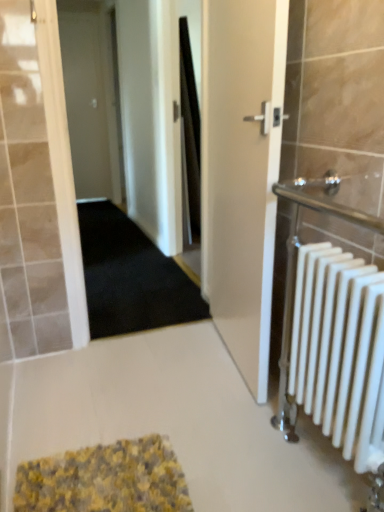
Describe the element at coordinates (85, 103) in the screenshot. I see `white matte door at upper left, the second door when ordered from bottom to top` at that location.

Describe the element at coordinates (340, 350) in the screenshot. I see `white matte radiator at right` at that location.

Where is `white glossy door at center, the first door in the bottom-to-top sequence`? white glossy door at center, the first door in the bottom-to-top sequence is located at coordinates (242, 173).

Where is `white matte door at upper left, the 2th door positioned from the right`? white matte door at upper left, the 2th door positioned from the right is located at coordinates (85, 103).

From the picture: Can you confirm if white glossy door at center, the 2th door from the back, is bigger than black carpet at center?

Actually, white glossy door at center, the 2th door from the back, might be smaller than black carpet at center.

Does white glossy door at center, which is counted as the 1th door, starting from the right, have a lesser width compared to black carpet at center?

Yes.

How many degrees apart are the facing directions of white glossy door at center, which ranks as the 2th door in left-to-right order, and black carpet at center?

The angle between the facing direction of white glossy door at center, which ranks as the 2th door in left-to-right order, and the facing direction of black carpet at center is 94.4 degrees.

Is white glossy door at center, the 2th door from the back, surrounding black carpet at center?

No, black carpet at center is not a part of white glossy door at center, the 2th door from the back.

Is yellow textured bath mat at lower center with black carpet at center?

They are not placed beside each other.

Which object is positioned more to the right, yellow textured bath mat at lower center or black carpet at center?

From the viewer's perspective, yellow textured bath mat at lower center appears more on the right side.

Can we say yellow textured bath mat at lower center lies outside black carpet at center?

Indeed, yellow textured bath mat at lower center is completely outside black carpet at center.

Can you tell me how much white matte door at upper left, the 2th door positioned from the right, and yellow textured bath mat at lower center differ in facing direction?

180 degrees separate the facing orientations of white matte door at upper left, the 2th door positioned from the right, and yellow textured bath mat at lower center.

Considering the sizes of objects white matte door at upper left, the 1th door when ordered from left to right, and yellow textured bath mat at lower center in the image provided, who is bigger, white matte door at upper left, the 1th door when ordered from left to right, or yellow textured bath mat at lower center?

Bigger between the two is white matte door at upper left, the 1th door when ordered from left to right.

Is white matte door at upper left, the 1th door from the back, next to yellow textured bath mat at lower center?

No, white matte door at upper left, the 1th door from the back, is not in contact with yellow textured bath mat at lower center.

Relative to white glossy door at center, the first door in the bottom-to-top sequence, is white matte radiator at right in front or behind?

white matte radiator at right is in front of white glossy door at center, the first door in the bottom-to-top sequence.

Is white matte radiator at right in contact with white glossy door at center, which ranks as the 2th door in left-to-right order?

white matte radiator at right and white glossy door at center, which ranks as the 2th door in left-to-right order, are clearly separated.

Considering the positions of points (325, 295) and (225, 87), is point (325, 295) closer to camera compared to point (225, 87)?

Yes, it is in front of point (225, 87).

Which of these two, white matte radiator at right or white glossy door at center, which ranks as the 2th door in left-to-right order, is smaller?

With smaller size is white matte radiator at right.

From a real-world perspective, does black carpet at center stand above white matte door at upper left, the 1th door when ordered from left to right?

Actually, black carpet at center is physically below white matte door at upper left, the 1th door when ordered from left to right, in the real world.

Considering the sizes of black carpet at center and white matte door at upper left, the 1th door from the back, in the image, is black carpet at center bigger or smaller than white matte door at upper left, the 1th door from the back,?

In the image, black carpet at center appears to be larger than white matte door at upper left, the 1th door from the back.

From the image's perspective, is black carpet at center located above white matte door at upper left, the second door when ordered from bottom to top?

No, from the image's perspective, black carpet at center is not over white matte door at upper left, the second door when ordered from bottom to top.

How much distance is there between black carpet at center and white matte door at upper left, the second door when ordered from bottom to top?

black carpet at center and white matte door at upper left, the second door when ordered from bottom to top, are 2.45 meters apart from each other.

From the image's perspective, between white matte door at upper left, arranged as the 1th door when viewed from the top, and black carpet at center, who is located below?

black carpet at center.

Based on the photo, is black carpet at center at the back of white matte door at upper left, the 1th door from the back?

No, white matte door at upper left, the 1th door from the back,'s orientation is not away from black carpet at center.

Is white matte door at upper left, the 1th door when ordered from left to right, at the left side of black carpet at center?

Indeed, white matte door at upper left, the 1th door when ordered from left to right, is positioned on the left side of black carpet at center.

Measure the distance from white matte door at upper left, the second door when ordered from bottom to top, to black carpet at center.

white matte door at upper left, the second door when ordered from bottom to top, and black carpet at center are 8.04 feet apart from each other.

In order to click on door to the left of white glossy door at center, which ranks as the 2th door in left-to-right order in this screenshot , I will do `click(85, 103)`.

Is white glossy door at center, which is counted as the 1th door, starting from the right, positioned with its back to white matte door at upper left, the 1th door when ordered from left to right?

white glossy door at center, which is counted as the 1th door, starting from the right, is not turned away from white matte door at upper left, the 1th door when ordered from left to right.

Does point (266, 187) lie in front of point (92, 90)?

That is True.

How many degrees apart are the facing directions of white glossy door at center, arranged as the first door when viewed from the front, and white matte door at upper left, the 1th door when ordered from left to right?

white glossy door at center, arranged as the first door when viewed from the front, and white matte door at upper left, the 1th door when ordered from left to right, are facing 94.4 degrees away from each other.

Identify the location of door in front of the black carpet at center. coord(242,173).

There is a yellow textured bath mat at lower center. Where is `doormat above it (from a real-world perspective)`? The image size is (384, 512). doormat above it (from a real-world perspective) is located at coordinates (131, 276).

Estimate the real-world distances between objects in this image. Which object is further from white matte radiator at right, black carpet at center or white matte door at upper left, arranged as the 1th door when viewed from the top?

Among the two, white matte door at upper left, arranged as the 1th door when viewed from the top, is located further to white matte radiator at right.

From the image, which object appears to be nearer to white matte door at upper left, arranged as the 1th door when viewed from the top, black carpet at center or white matte radiator at right?

Based on the image, black carpet at center appears to be nearer to white matte door at upper left, arranged as the 1th door when viewed from the top.

When comparing their distances from white matte radiator at right, does white matte door at upper left, the 1th door from the back, or yellow textured bath mat at lower center seem closer?

yellow textured bath mat at lower center.

Considering their positions, is white matte door at upper left, arranged as the 1th door when viewed from the top, positioned further to white matte radiator at right than black carpet at center?

The object further to white matte radiator at right is white matte door at upper left, arranged as the 1th door when viewed from the top.

Estimate the real-world distances between objects in this image. Which object is closer to white glossy door at center, which ranks as the 2th door in left-to-right order, yellow textured bath mat at lower center or white matte door at upper left, the 1th door when ordered from left to right?

The object closer to white glossy door at center, which ranks as the 2th door in left-to-right order, is yellow textured bath mat at lower center.

When comparing their distances from black carpet at center, does white glossy door at center, arranged as the first door when viewed from the front, or white matte radiator at right seem further?

Among the two, white matte radiator at right is located further to black carpet at center.

Which object lies further to the anchor point white matte door at upper left, marked as the second door in a front-to-back arrangement, black carpet at center or yellow textured bath mat at lower center?

Among the two, yellow textured bath mat at lower center is located further to white matte door at upper left, marked as the second door in a front-to-back arrangement.

When comparing their distances from white matte door at upper left, the second door when ordered from bottom to top, does yellow textured bath mat at lower center or white glossy door at center, arranged as the first door when viewed from the front, seem further?

The object further to white matte door at upper left, the second door when ordered from bottom to top, is yellow textured bath mat at lower center.

Locate an element on the screen. The width and height of the screenshot is (384, 512). door between yellow textured bath mat at lower center and black carpet at center along the z-axis is located at coordinates (242, 173).

The height and width of the screenshot is (512, 384). In order to click on doormat between white glossy door at center, the 2th door from the back, and white matte door at upper left, the 1th door from the back, from front to back in this screenshot , I will do `click(131, 276)`.

This screenshot has width=384, height=512. In order to click on door located between white matte radiator at right and white matte door at upper left, the 2th door positioned from the right, in the depth direction in this screenshot , I will do `click(242, 173)`.

Identify the location of door positioned between yellow textured bath mat at lower center and white matte door at upper left, the 1th door from the back, from near to far. (242, 173).